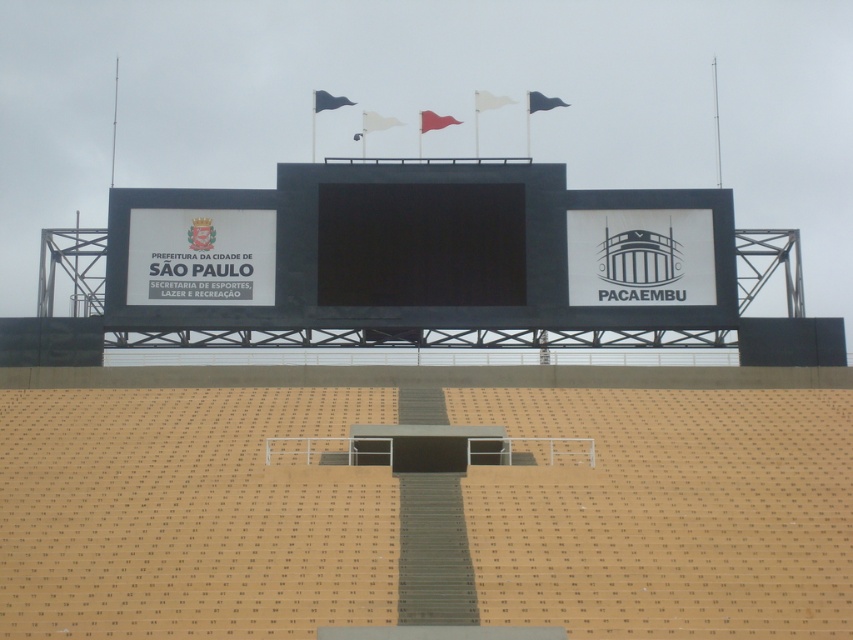
Is black matte scoreboard at center wider than black fabric flag at upper center?

Yes, black matte scoreboard at center is wider than black fabric flag at upper center.

Which is in front, point (689, 282) or point (531, 112)?

Point (689, 282)

I want to click on black matte scoreboard at center, so click(x=433, y=252).

Consider the image. Who is more forward, (329, 100) or (529, 104)?

Point (329, 100)

Locate an element on the screen. This screenshot has width=853, height=640. blue fabric flag at upper center is located at coordinates (328, 100).

Does point (321, 99) come in front of point (538, 106)?

That is True.

I want to click on blue fabric flag at upper center, so click(328, 100).

Who is more distant from viewer, [573,323] or [479,112]?

Point [479,112]

Does black matte scoreboard at center have a smaller size compared to white fabric flag at upper center?

No.

You are a GUI agent. You are given a task and a screenshot of the screen. Output one action in this format:
    pyautogui.click(x=<x>, y=<y>)
    Task: Click on the black matte scoreboard at center
    This screenshot has width=853, height=640.
    Given the screenshot: What is the action you would take?
    pyautogui.click(x=433, y=252)